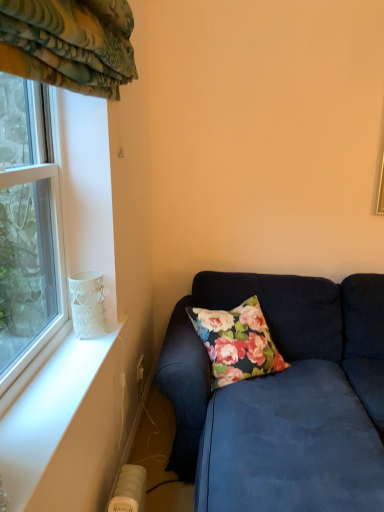
What is the approximate width of velvet blue couch at lower right?

The width of velvet blue couch at lower right is 1.84 meters.

Image resolution: width=384 pixels, height=512 pixels. In order to click on velvet blue couch at lower right in this screenshot , I will do `click(283, 398)`.

Measure the distance between clear glass window at left and camera.

A distance of 1.29 meters exists between clear glass window at left and camera.

In order to face white lace glass at window, should I rotate leftwards or rightwards?

A 13.510 degree turn to the left will do.

Describe the element at coordinates (88, 304) in the screenshot. I see `white lace glass at window` at that location.

Image resolution: width=384 pixels, height=512 pixels. In order to click on velvet blue couch at lower right in this screenshot , I will do `click(283, 398)`.

Considering the positions of point (183, 310) and point (70, 293), is point (183, 310) closer or farther from the camera than point (70, 293)?

Clearly, point (183, 310) is more distant from the camera than point (70, 293).

Which of these two, velvet blue couch at lower right or white lace glass at window, is smaller?

white lace glass at window.

From the image's perspective, would you say velvet blue couch at lower right is shown under white lace glass at window?

Yes.

Does point (42, 241) come farther from viewer compared to point (86, 313)?

Yes, it is behind point (86, 313).

Could you tell me if clear glass window at left is turned towards white lace glass at window?

Yes.

Is clear glass window at left not close to white lace glass at window?

No, clear glass window at left is in close proximity to white lace glass at window.

Between clear glass window at left and white lace glass at window, which one has more height?

With more height is clear glass window at left.

Is white lace glass at window positioned with its back to clear glass window at left?

Yes, white lace glass at window is facing away from clear glass window at left.

Which point is more distant from viewer, (85, 336) or (32, 335)?

The point (32, 335) is farther from the camera.

From a real-world perspective, relative to clear glass window at left, is white lace glass at window vertically above or below?

In terms of real-world spatial position, white lace glass at window is below clear glass window at left.

Considering the sizes of white lace glass at window and clear glass window at left in the image, is white lace glass at window wider or thinner than clear glass window at left?

Clearly, white lace glass at window has less width compared to clear glass window at left.

How different are the orientations of velvet blue couch at lower right and clear glass window at left in degrees?

92.9 degrees.

Is velvet blue couch at lower right not near clear glass window at left?

No, there isn't a large distance between velvet blue couch at lower right and clear glass window at left.

Is clear glass window at left surrounded by velvet blue couch at lower right?

No, clear glass window at left is not inside velvet blue couch at lower right.

Image resolution: width=384 pixels, height=512 pixels. In order to click on window on the left of velvet blue couch at lower right in this screenshot , I will do `click(28, 227)`.

Can you confirm if clear glass window at left is shorter than velvet blue couch at lower right?

In fact, clear glass window at left may be taller than velvet blue couch at lower right.

Is clear glass window at left not within velvet blue couch at lower right?

Yes, clear glass window at left is outside of velvet blue couch at lower right.

Consider the image. Is clear glass window at left next to velvet blue couch at lower right and touching it?

clear glass window at left and velvet blue couch at lower right are clearly separated.

Which is in front, point (73, 280) or point (225, 284)?

The point (73, 280) is closer.

In the image, is white lace glass at window on the left side or the right side of velvet blue couch at lower right?

In the image, white lace glass at window appears on the left side of velvet blue couch at lower right.

Is white lace glass at window behind velvet blue couch at lower right?

Yes, white lace glass at window is behind velvet blue couch at lower right.

Identify the location of glass vase above the velvet blue couch at lower right (from a real-world perspective). The height and width of the screenshot is (512, 384). (88, 304).

This screenshot has height=512, width=384. What are the coordinates of `window above the white lace glass at window (from the image's perspective)` in the screenshot? It's located at (28, 227).

Based on their spatial positions, is clear glass window at left or velvet blue couch at lower right further from white lace glass at window?

velvet blue couch at lower right.

From the image, which object appears to be farther from clear glass window at left, white lace glass at window or velvet blue couch at lower right?

Based on the image, velvet blue couch at lower right appears to be further to clear glass window at left.

Based on their spatial positions, is white lace glass at window or clear glass window at left closer to velvet blue couch at lower right?

Among the two, white lace glass at window is located nearer to velvet blue couch at lower right.

Which object lies nearer to the anchor point white lace glass at window, velvet blue couch at lower right or clear glass window at left?

clear glass window at left.

Considering their positions, is clear glass window at left positioned further to velvet blue couch at lower right than white lace glass at window?

clear glass window at left lies further to velvet blue couch at lower right than the other object.

Which object lies further to the anchor point clear glass window at left, velvet blue couch at lower right or white lace glass at window?

Based on the image, velvet blue couch at lower right appears to be further to clear glass window at left.

I want to click on glass vase between clear glass window at left and velvet blue couch at lower right in the horizontal direction, so click(x=88, y=304).